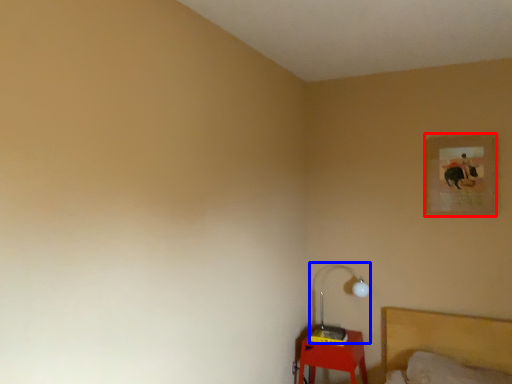
Question: Which object is further to the camera taking this photo, picture frame (highlighted by a red box) or lamp (highlighted by a blue box)?

Choices:
 (A) picture frame
 (B) lamp

Answer: (B)